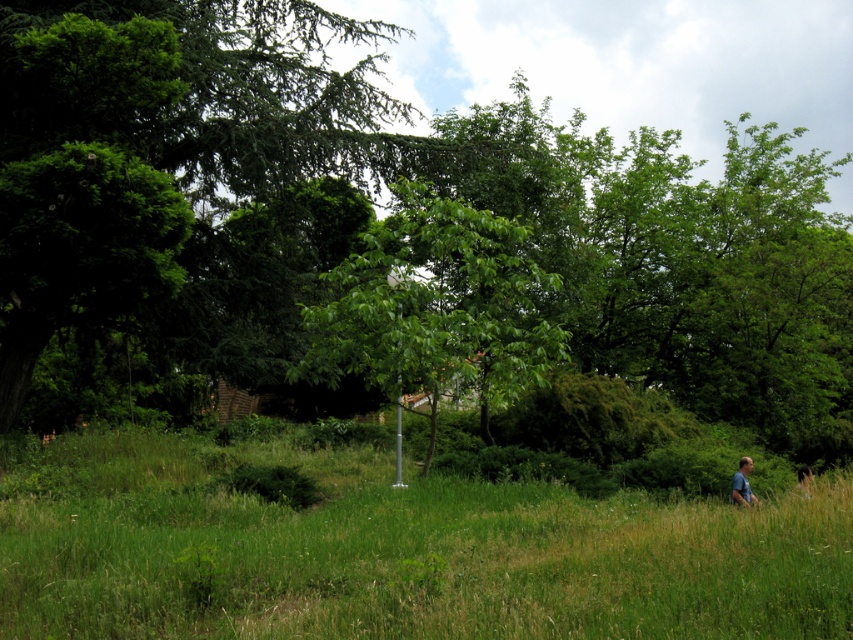
You are standing at the center of the image and want to move towards the green grass at lower right. What direction should you move in?

You should move towards the lower right direction to reach the green grass at lower right.

You are standing in the park and see the green grass at lower right and the green leafy tree at center. Which object is located to the right of the other?

The green grass at lower right is positioned on the right side of green leafy tree at center.